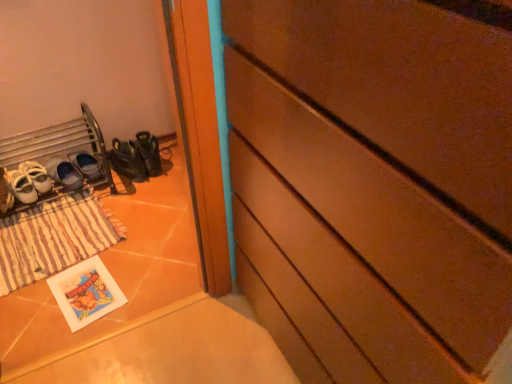
I want to click on free point in front of green rubber boots at lower left, so click(152, 183).